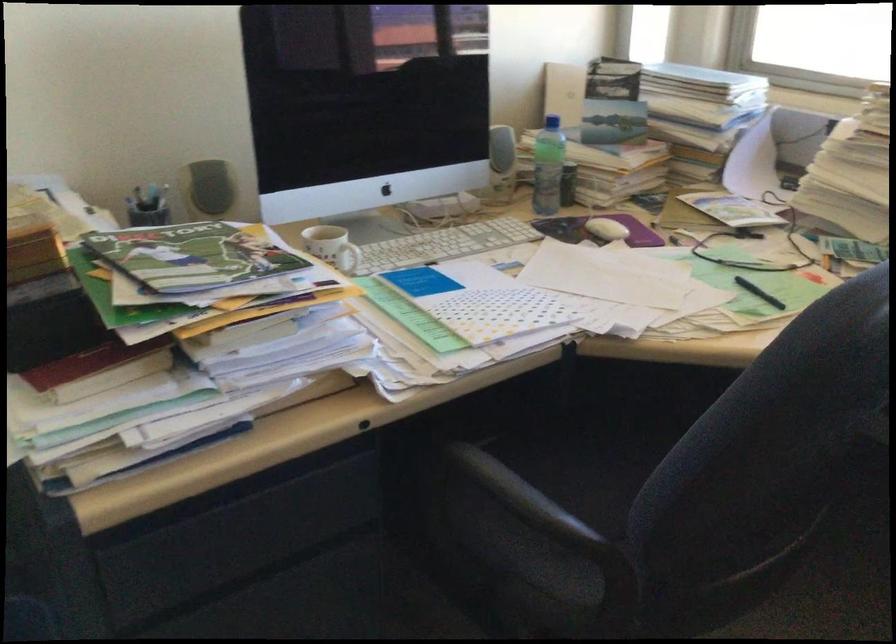
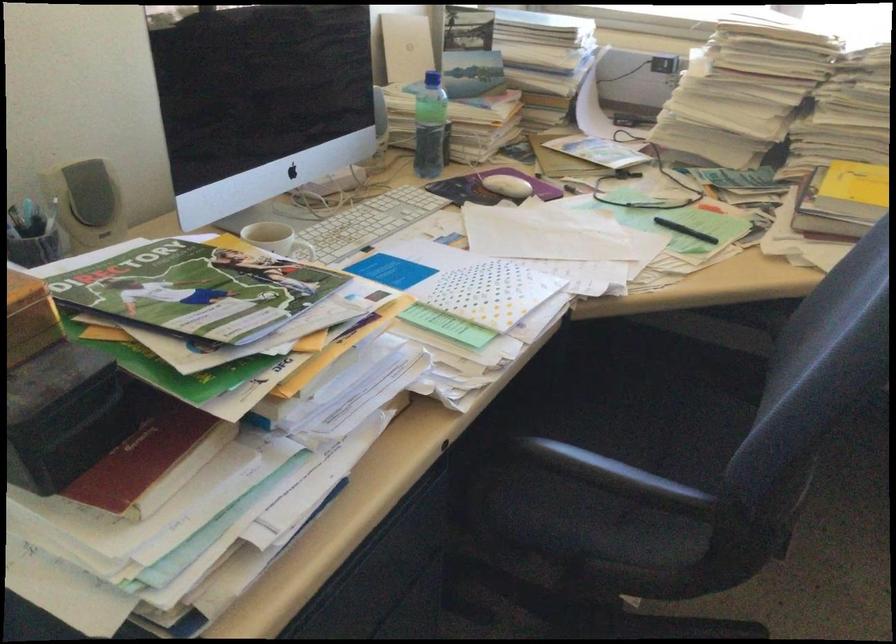
The point at (x=348, y=254) is marked in the first image. Where is the corresponding point in the second image?

(306, 252)